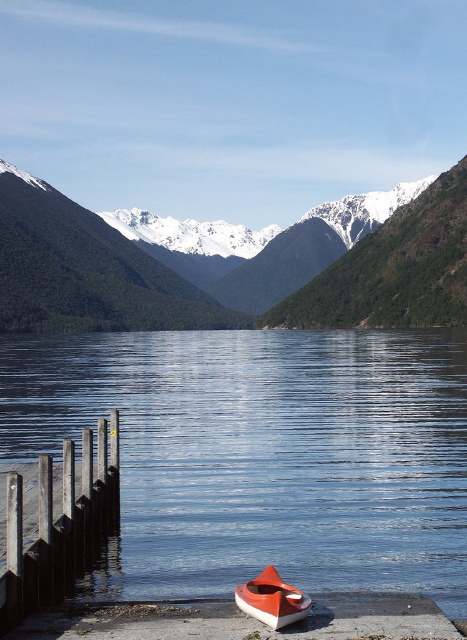
Is green matte mountain at center bigger than orange matte boat at lower center?

Indeed, green matte mountain at center has a larger size compared to orange matte boat at lower center.

Image resolution: width=467 pixels, height=640 pixels. Describe the element at coordinates (235, 268) in the screenshot. I see `green matte mountain at center` at that location.

This screenshot has height=640, width=467. Find the location of `green matte mountain at center`. green matte mountain at center is located at coordinates (235, 268).

What do you see at coordinates (235, 268) in the screenshot?
I see `green matte mountain at center` at bounding box center [235, 268].

Does point (82, 288) come behind point (18, 536)?

Yes, point (82, 288) is farther from viewer.

The height and width of the screenshot is (640, 467). What are the coordinates of `green matte mountain at center` in the screenshot? It's located at (235, 268).

Can you confirm if dark gray wooden posts at lower left is shorter than orange matte boat at lower center?

Incorrect, dark gray wooden posts at lower left's height does not fall short of orange matte boat at lower center's.

This screenshot has width=467, height=640. Describe the element at coordinates (59, 524) in the screenshot. I see `dark gray wooden posts at lower left` at that location.

Is point (28, 557) farther from viewer compared to point (304, 611)?

That is False.

This screenshot has width=467, height=640. Identify the location of dark gray wooden posts at lower left. (59, 524).